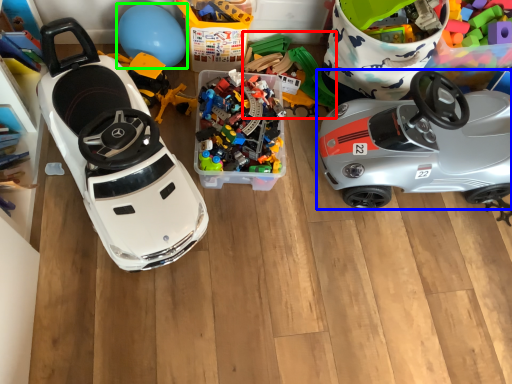
Question: Which is nearer to the toy (highlighted by a red box)? car (highlighted by a blue box) or balloon (highlighted by a green box).

Choices:
 (A) car
 (B) balloon

Answer: (A)